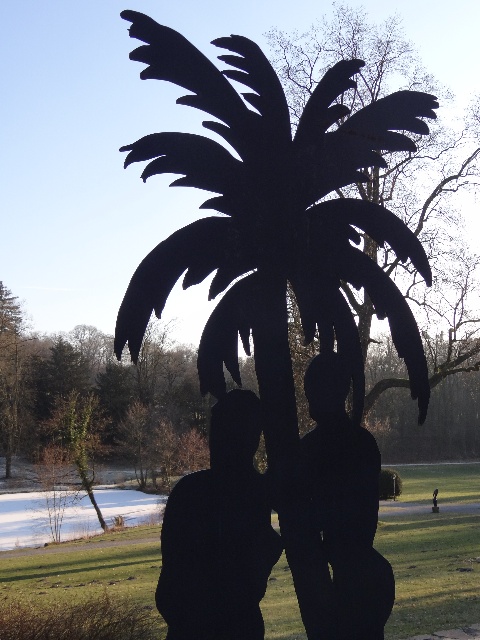
Can you confirm if black matte couple at center is thinner than black matte man at center?

No, black matte couple at center is not thinner than black matte man at center.

Which of these two, black matte couple at center or black matte man at center, stands taller?

black matte couple at center

The width and height of the screenshot is (480, 640). In order to click on black matte couple at center in this screenshot , I will do `click(280, 525)`.

At what (x,y) coordinates should I click in order to perform the action: click on black matte couple at center. Please return your answer as a coordinate pair (x, y). This screenshot has height=640, width=480. Looking at the image, I should click on 280,525.

Describe the element at coordinates (274, 221) in the screenshot. I see `black matte palm tree at center` at that location.

Does point (385, 300) lie in front of point (365, 582)?

That is False.

Where is `black matte palm tree at center`? This screenshot has width=480, height=640. black matte palm tree at center is located at coordinates (274, 221).

Who is shorter, black matte palm tree at center or black matte statue at center?

black matte statue at center is shorter.

Who is positioned more to the left, black matte palm tree at center or black matte statue at center?

From the viewer's perspective, black matte statue at center appears more on the left side.

Between point (276, 416) and point (202, 556), which one is positioned behind?

Positioned behind is point (276, 416).

Where is `black matte palm tree at center`? The width and height of the screenshot is (480, 640). black matte palm tree at center is located at coordinates (274, 221).